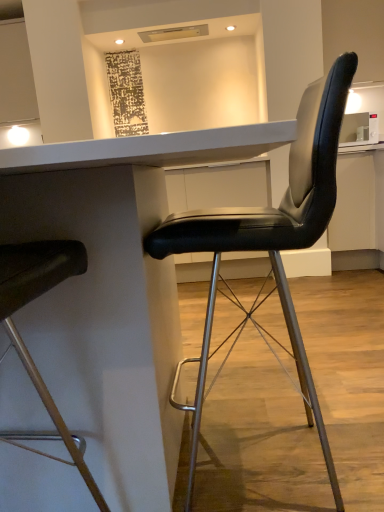
Question: From the image's perspective, is black leather chair at right, the first chair in the right-to-left sequence, above or below matte black chair at left, the 1th chair in the left-to-right sequence?

Choices:
 (A) below
 (B) above

Answer: (B)

Question: From a real-world perspective, is black leather chair at right, the first chair in the right-to-left sequence, positioned above or below matte black chair at left, which appears as the 2th chair when viewed from the right?

Choices:
 (A) below
 (B) above

Answer: (A)

Question: Which object is the closest to the white glossy table at center?

Choices:
 (A) matte black chair at left, which appears as the 2th chair when viewed from the right
 (B) black leather chair at right, the first chair in the right-to-left sequence

Answer: (A)

Question: Considering the real-world distances, which object is closest to the white glossy table at center?

Choices:
 (A) matte black chair at left, the 1th chair in the left-to-right sequence
 (B) black leather chair at right, the first chair in the right-to-left sequence

Answer: (A)